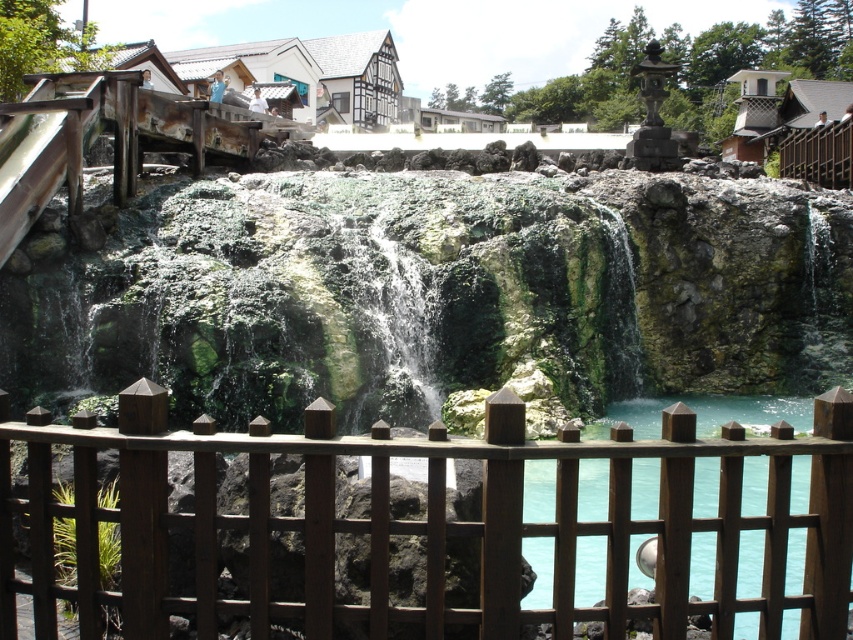
Question: Is brown wooden fence at center positioned in front of turquoise glass water at center?

Choices:
 (A) no
 (B) yes

Answer: (B)

Question: Can you confirm if brown wooden fence at center is bigger than turquoise glass water at center?

Choices:
 (A) yes
 (B) no

Answer: (A)

Question: Is brown wooden fence at center wider than turquoise glass water at center?

Choices:
 (A) yes
 (B) no

Answer: (A)

Question: Which point is farther from the camera taking this photo?

Choices:
 (A) (741, 528)
 (B) (757, 420)

Answer: (B)